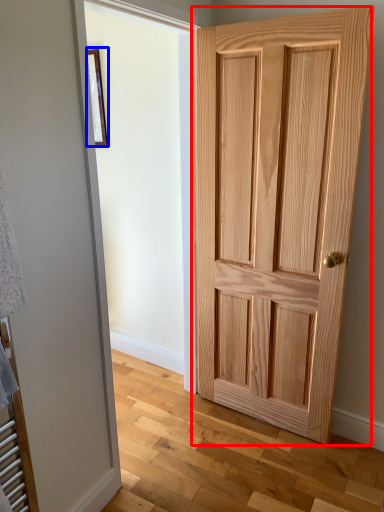
Question: Which object is closer to the camera taking this photo, door (highlighted by a red box) or picture frame (highlighted by a blue box)?

Choices:
 (A) door
 (B) picture frame

Answer: (A)